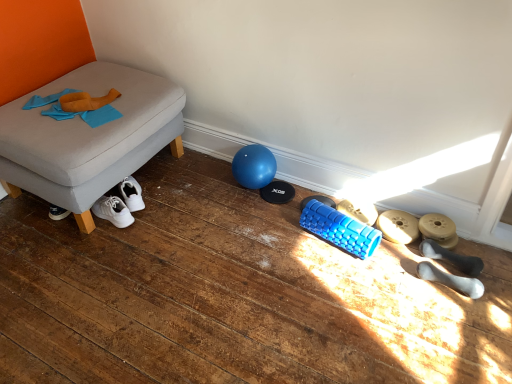
Identify the location of vacant space in front of matte gray dumbbell at lower right, the 2th footwear positioned from the back. The image size is (512, 384). (397, 263).